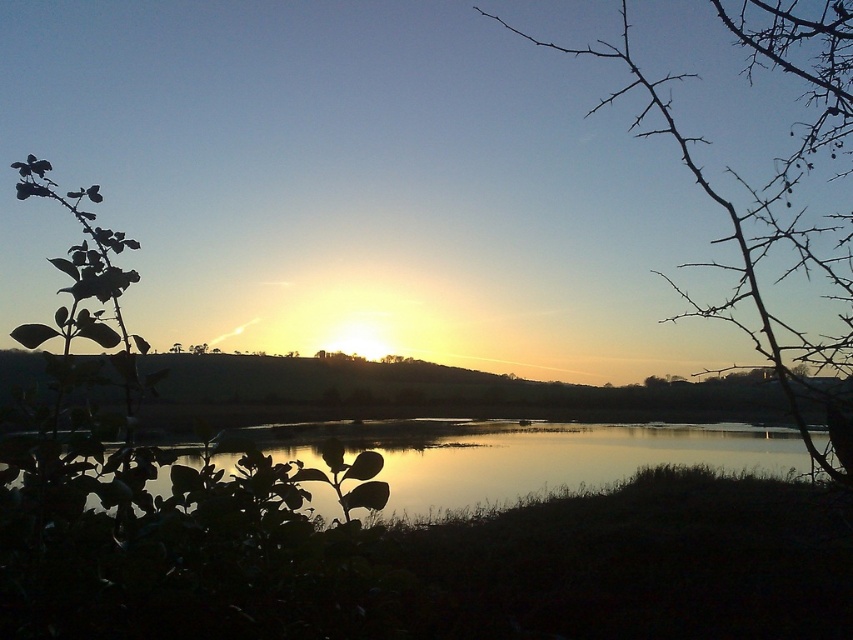
Question: Is bare branches at right thinner than silvery reflective water at center?

Choices:
 (A) no
 (B) yes

Answer: (B)

Question: Which point appears farthest from the camera in this image?

Choices:
 (A) (845, 300)
 (B) (289, 456)

Answer: (B)

Question: Which of the following is the farthest from the observer?

Choices:
 (A) silvery reflective water at center
 (B) bare branches at right

Answer: (A)

Question: Is the position of bare branches at right less distant than that of silvery reflective water at center?

Choices:
 (A) no
 (B) yes

Answer: (B)

Question: Among these points, which one is farthest from the camera?

Choices:
 (A) (498, 20)
 (B) (515, 500)

Answer: (B)

Question: Is bare branches at right to the right of silvery reflective water at center from the viewer's perspective?

Choices:
 (A) yes
 (B) no

Answer: (A)